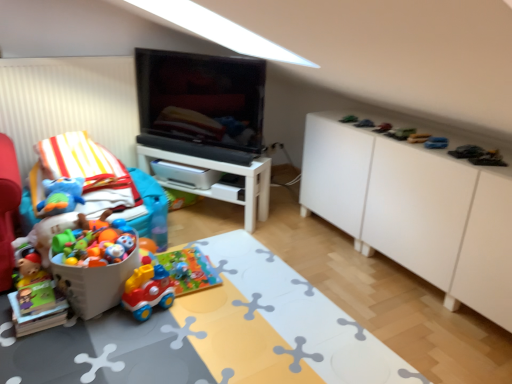
Image resolution: width=512 pixels, height=384 pixels. Identify the location of free space in front of blue rubber toy at upper right, which ranks as the ninth toy in left-to-right order. (445, 152).